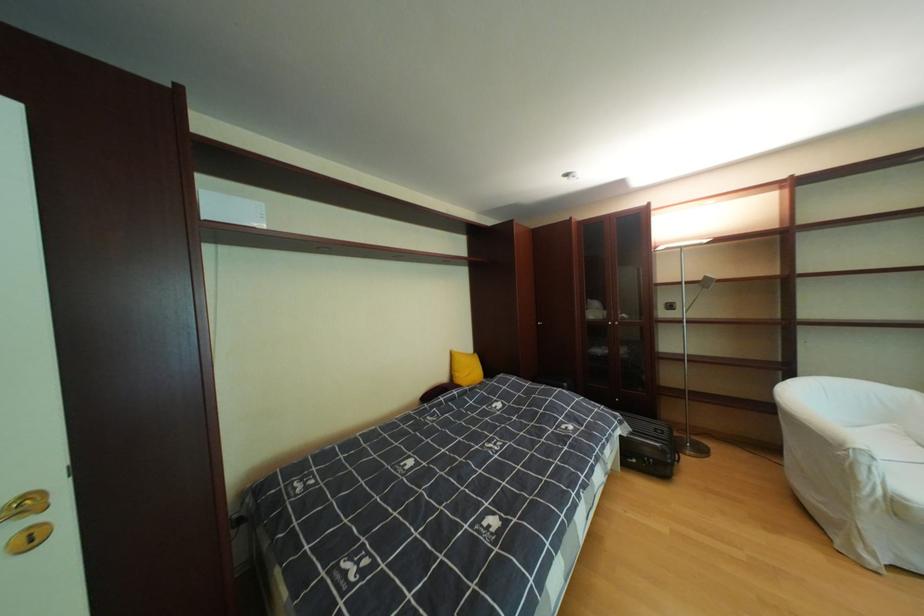
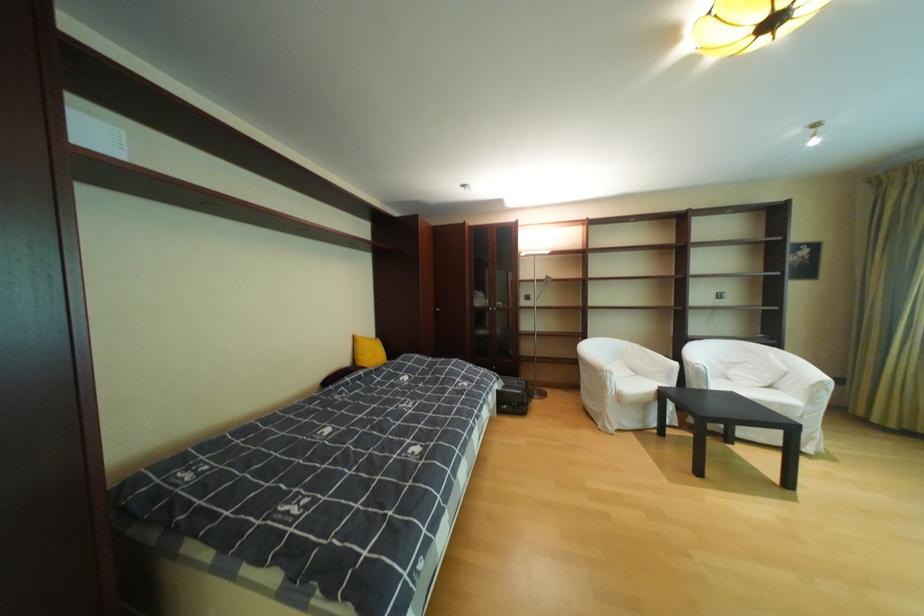
Where in the second image is the point corresponding to point 877,508 from the first image?

(621, 402)